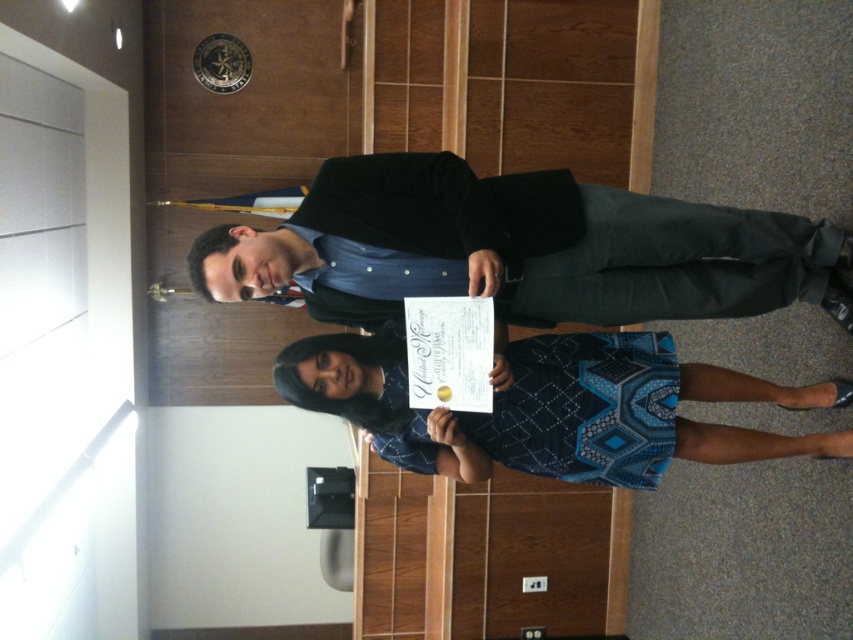
Question: Which of the following is the farthest from the observer?

Choices:
 (A) (454, 227)
 (B) (601, 449)

Answer: (B)

Question: Which object is closer to the camera taking this photo?

Choices:
 (A) black smooth suit at center
 (B) blue printed fabric dress at center

Answer: (A)

Question: Can you confirm if black smooth suit at center is positioned to the right of blue printed fabric dress at center?

Choices:
 (A) yes
 (B) no

Answer: (A)

Question: Does black smooth suit at center appear under blue printed fabric dress at center?

Choices:
 (A) yes
 (B) no

Answer: (B)

Question: Does black smooth suit at center have a larger size compared to blue printed fabric dress at center?

Choices:
 (A) yes
 (B) no

Answer: (A)

Question: Which object appears closest to the camera in this image?

Choices:
 (A) black smooth suit at center
 (B) blue printed fabric dress at center

Answer: (A)